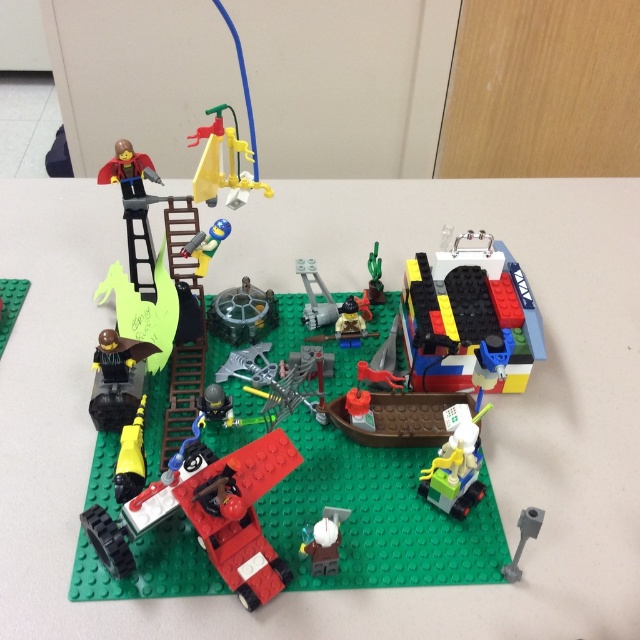
Who is shorter, green matte baseplate at center or metallic silver gear at center?

With less height is metallic silver gear at center.

Locate an element on the screen. green matte baseplate at center is located at coordinates (346, 291).

Which is behind, point (80, 448) or point (243, 292)?

The point (243, 292) is more distant.

The width and height of the screenshot is (640, 640). Identify the location of green matte baseplate at center. (346, 291).

Between metallic silver gear at center and green matte cactus at center, which one is positioned higher?

green matte cactus at center is higher up.

This screenshot has width=640, height=640. Identify the location of metallic silver gear at center. point(243,314).

Who is shorter, smooth brown minifigure at center or smooth blue figure at center?

Standing shorter between the two is smooth blue figure at center.

Measure the distance between smooth brown minifigure at center and camera.

smooth brown minifigure at center is 1.08 meters from camera.

Is point (356, 332) positioned before point (195, 257)?

No, (356, 332) is behind (195, 257).

At what (x,y) coordinates should I click in order to perform the action: click on smooth brown minifigure at center. Please return your answer as a coordinate pair (x, y). The height and width of the screenshot is (640, 640). Looking at the image, I should click on (349, 321).